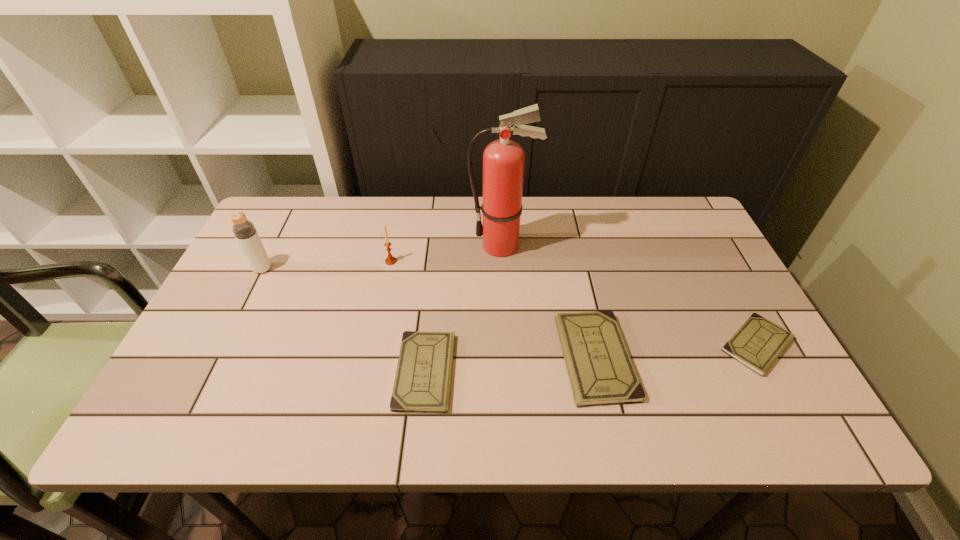
Identify which object is located as the fifth nearest to the rightmost object. Please provide its 2D coordinates. Your answer should be formatted as a tuple, i.e. [(x, y)], where the tuple contains the x and y coordinates of a point satisfying the conditions above.

[(244, 230)]

The image size is (960, 540). Identify the location of object that is the second closest to the shortest checkbook. (503, 160).

I want to click on checkbook that can be found as the second closest to the rightmost checkbook, so click(x=422, y=382).

Where is `checkbook that can be found as the closest to the leftmost checkbook`? The height and width of the screenshot is (540, 960). checkbook that can be found as the closest to the leftmost checkbook is located at coordinates pyautogui.click(x=601, y=372).

Locate an element on the screen. The image size is (960, 540). blank area in the image that satisfies the following two spatial constraints: 1. on the hose direction of the fire extinguisher; 2. on the right side of the fourth tallest object is located at coordinates (508, 358).

Locate an element on the screen. vacant point that satisfies the following two spatial constraints: 1. on the hose direction of the rightmost object; 2. on the right side of the fourth object from left to right is located at coordinates (507, 345).

Locate an element on the screen. This screenshot has width=960, height=540. vacant space that satisfies the following two spatial constraints: 1. on the back side of the rightmost checkbook; 2. on the left side of the second object from right to left is located at coordinates (592, 345).